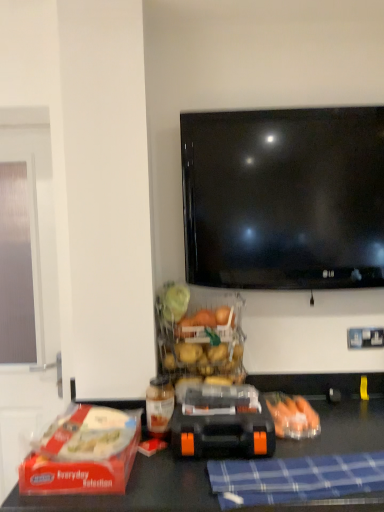
This screenshot has width=384, height=512. Find the location of `red plastic lunch box at lower left`. red plastic lunch box at lower left is located at coordinates (83, 453).

Measure the distance between point (358, 465) and camera.

1.15 meters.

This screenshot has height=512, width=384. What are the coordinates of `orange rubber toy car at center` in the screenshot? It's located at tap(222, 423).

Describe the element at coordinates (222, 423) in the screenshot. This screenshot has width=384, height=512. I see `orange rubber toy car at center` at that location.

At what (x,y) coordinates should I click in order to perform the action: click on red plastic lunch box at lower left. Please return your answer as a coordinate pair (x, y). Image resolution: width=384 pixels, height=512 pixels. Looking at the image, I should click on (83, 453).

From a real-world perspective, is red plastic lunch box at lower left positioned under orange rubber toy car at center based on gravity?

Yes, from a real-world perspective, red plastic lunch box at lower left is under orange rubber toy car at center.

Which is in front, point (63, 441) or point (195, 434)?

The point (63, 441) is closer to the camera.

I want to click on lunch box that is below the orange rubber toy car at center (from the image's perspective), so click(83, 453).

What's the angular difference between red plastic lunch box at lower left and orange rubber toy car at center's facing directions?

The angular difference between red plastic lunch box at lower left and orange rubber toy car at center is 0.432 degrees.

Which object is further away from the camera taking this photo, translucent plastic bottle at center or blue checkered cloth at lower center?

translucent plastic bottle at center is further away from the camera.

Could you tell me if translucent plastic bottle at center is facing blue checkered cloth at lower center?

No, translucent plastic bottle at center is not facing towards blue checkered cloth at lower center.

The image size is (384, 512). I want to click on blanket in front of the translucent plastic bottle at center, so click(294, 478).

In terms of height, does translucent plastic carrots at lower right look taller or shorter compared to orange rubber toy car at center?

Clearly, translucent plastic carrots at lower right is shorter compared to orange rubber toy car at center.

Which of these two, translucent plastic carrots at lower right or orange rubber toy car at center, is thinner?

Thinner between the two is orange rubber toy car at center.

Is translucent plastic carrots at lower right inside or outside of orange rubber toy car at center?

The correct answer is: outside.

From a real-world perspective, is blue checkered cloth at lower center over translucent plastic carrots at lower right?

No, from a real-world perspective, blue checkered cloth at lower center is not over translucent plastic carrots at lower right

Could you tell me if blue checkered cloth at lower center is facing translucent plastic carrots at lower right?

No, blue checkered cloth at lower center does not turn towards translucent plastic carrots at lower right.

Does blue checkered cloth at lower center come behind translucent plastic carrots at lower right?

No, blue checkered cloth at lower center is in front of translucent plastic carrots at lower right.

From the image's perspective, is blue checkered cloth at lower center under translucent plastic carrots at lower right?

Indeed, from the image's perspective, blue checkered cloth at lower center is shown beneath translucent plastic carrots at lower right.

Between red plastic lunch box at lower left and blue checkered cloth at lower center, which one appears on the left side from the viewer's perspective?

red plastic lunch box at lower left.

The height and width of the screenshot is (512, 384). What are the coordinates of `blanket below the red plastic lunch box at lower left (from a real-world perspective)` in the screenshot? It's located at (294, 478).

Relative to blue checkered cloth at lower center, is red plastic lunch box at lower left in front or behind?

red plastic lunch box at lower left is behind blue checkered cloth at lower center.

From the image's perspective, which one is positioned higher, red plastic lunch box at lower left or blue checkered cloth at lower center?

red plastic lunch box at lower left, from the image's perspective.

Could you tell me if orange rubber toy car at center is facing translucent plastic carrots at lower right?

No, orange rubber toy car at center does not turn towards translucent plastic carrots at lower right.

How distant is orange rubber toy car at center from translucent plastic carrots at lower right?

orange rubber toy car at center and translucent plastic carrots at lower right are 7.00 inches apart.

Would you consider orange rubber toy car at center to be distant from translucent plastic carrots at lower right?

They are positioned close to each other.

Is orange rubber toy car at center inside or outside of translucent plastic carrots at lower right?

orange rubber toy car at center is outside translucent plastic carrots at lower right.

In the image, is translucent plastic bottle at center positioned in front of or behind orange rubber toy car at center?

translucent plastic bottle at center is positioned farther from the viewer than orange rubber toy car at center.

Is translucent plastic bottle at center turned away from orange rubber toy car at center?

No, translucent plastic bottle at center is not facing the opposite direction of orange rubber toy car at center.

Which of these two, translucent plastic bottle at center or orange rubber toy car at center, stands shorter?

Standing shorter between the two is orange rubber toy car at center.

Identify the location of lunch box below the orange rubber toy car at center (from the image's perspective). The image size is (384, 512). (83, 453).

Locate an element on the screen. The width and height of the screenshot is (384, 512). bottle lying above the blue checkered cloth at lower center (from the image's perspective) is located at coordinates (159, 405).

From the picture: Looking at the image, which one is located further to translucent plastic bottle at center, orange rubber toy car at center or translucent plastic carrots at lower right?

The object further to translucent plastic bottle at center is translucent plastic carrots at lower right.

Considering their positions, is blue checkered cloth at lower center positioned closer to translucent plastic carrots at lower right than translucent plastic bottle at center?

blue checkered cloth at lower center is closer to translucent plastic carrots at lower right.

Estimate the real-world distances between objects in this image. Which object is closer to red plastic lunch box at lower left, orange rubber toy car at center or blue checkered cloth at lower center?

orange rubber toy car at center is closer to red plastic lunch box at lower left.

When comparing their distances from blue checkered cloth at lower center, does red plastic lunch box at lower left or translucent plastic carrots at lower right seem further?

red plastic lunch box at lower left.

When comparing their distances from translucent plastic carrots at lower right, does translucent plastic bottle at center or blue checkered cloth at lower center seem closer?

Among the two, blue checkered cloth at lower center is located nearer to translucent plastic carrots at lower right.

Which object lies nearer to the anchor point red plastic lunch box at lower left, translucent plastic carrots at lower right or translucent plastic bottle at center?

translucent plastic bottle at center lies closer to red plastic lunch box at lower left than the other object.

Based on the photo, looking at the image, which one is located further to blue checkered cloth at lower center, translucent plastic bottle at center or translucent plastic carrots at lower right?

Among the two, translucent plastic bottle at center is located further to blue checkered cloth at lower center.

When comparing their distances from translucent plastic carrots at lower right, does blue checkered cloth at lower center or orange rubber toy car at center seem further?

Among the two, blue checkered cloth at lower center is located further to translucent plastic carrots at lower right.

At what (x,y) coordinates should I click in order to perform the action: click on blanket situated between translucent plastic bottle at center and translucent plastic carrots at lower right from left to right. Please return your answer as a coordinate pair (x, y). The height and width of the screenshot is (512, 384). Looking at the image, I should click on (294, 478).

Where is `appliance between red plastic lunch box at lower left and translucent plastic carrots at lower right`? This screenshot has width=384, height=512. appliance between red plastic lunch box at lower left and translucent plastic carrots at lower right is located at coordinates (222, 423).

Where is `bottle located between red plastic lunch box at lower left and blue checkered cloth at lower center in the left-right direction`? bottle located between red plastic lunch box at lower left and blue checkered cloth at lower center in the left-right direction is located at coordinates (159, 405).

Locate an element on the screen. The width and height of the screenshot is (384, 512). blanket between red plastic lunch box at lower left and translucent plastic carrots at lower right from left to right is located at coordinates (294, 478).